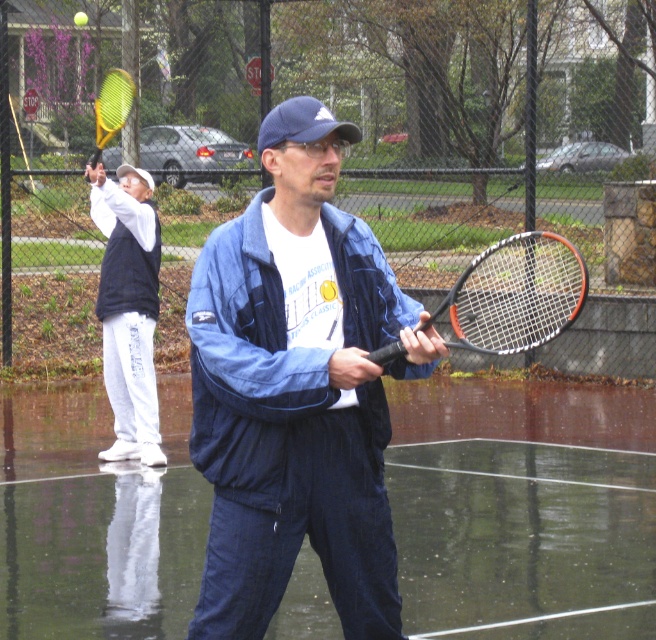
Does blue fabric jacket at center have a greater height compared to white fleece jacket at upper left?

Incorrect, blue fabric jacket at center's height is not larger of white fleece jacket at upper left's.

Between point (380, 481) and point (123, 180), which one is positioned behind?

Positioned behind is point (123, 180).

Locate an element on the screen. The image size is (656, 640). blue fabric jacket at center is located at coordinates (297, 401).

Based on the photo, measure the distance from blue fabric baseball cap at center to yellowmaterial tennis racket at left.

blue fabric baseball cap at center and yellowmaterial tennis racket at left are 12.44 meters apart from each other.

This screenshot has height=640, width=656. I want to click on blue fabric baseball cap at center, so click(x=302, y=124).

Is point (358, 132) positioned in front of point (110, 102)?

Yes.

Find the location of `blue fabric baseball cap at center`. blue fabric baseball cap at center is located at coordinates (302, 124).

Describe the element at coordinates (129, 308) in the screenshot. I see `white fleece jacket at upper left` at that location.

At what (x,y) coordinates should I click in order to perform the action: click on white fleece jacket at upper left. Please return your answer as a coordinate pair (x, y). This screenshot has height=640, width=656. Looking at the image, I should click on (129, 308).